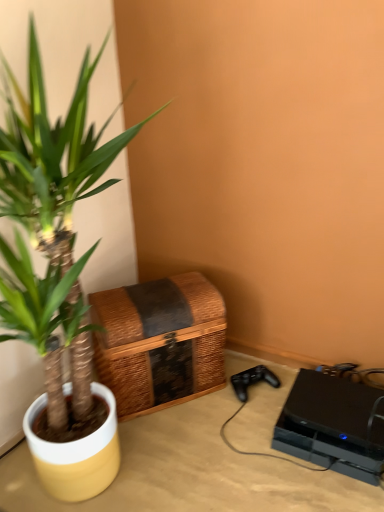
You are a GUI agent. You are given a task and a screenshot of the screen. Output one action in this format:
    pyautogui.click(x=<x>, y=<y>)
    Task: Click on the vacant space to the right of green leafy plant at left
    This screenshot has height=512, width=384.
    Given the screenshot: What is the action you would take?
    pyautogui.click(x=243, y=456)